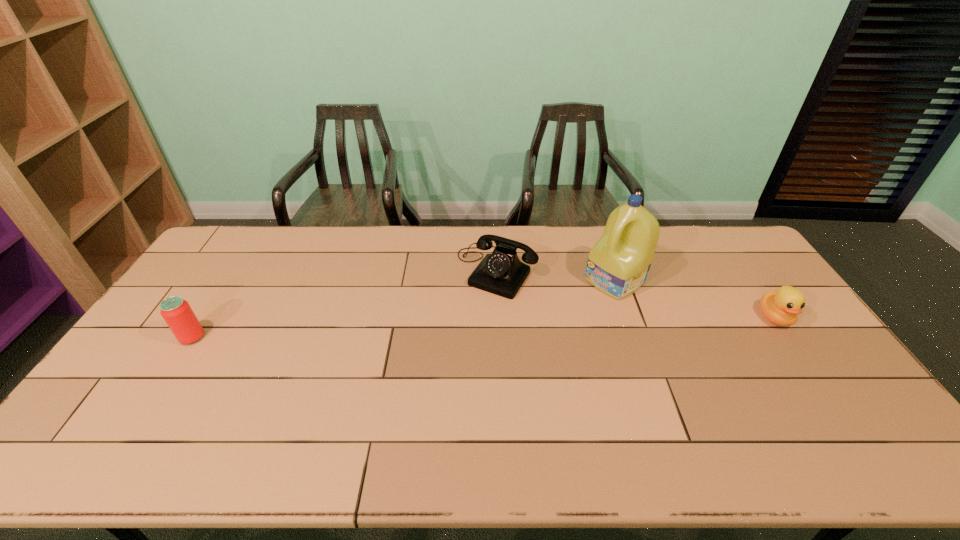
You are a GUI agent. You are given a task and a screenshot of the screen. Output one action in this format:
    pyautogui.click(x=<x>, y=<y>)
    Task: Click on the free spot located 0.140m on the front face of the second object from left to right
    The image size is (960, 540).
    Given the screenshot: What is the action you would take?
    pyautogui.click(x=458, y=325)

Where is `vacant space located 0.370m on the front face of the second object from left to right`? Image resolution: width=960 pixels, height=540 pixels. vacant space located 0.370m on the front face of the second object from left to right is located at coordinates click(418, 382).

The height and width of the screenshot is (540, 960). I want to click on vacant space located on the front face of the second object from left to right, so click(x=458, y=325).

Locate an element on the screen. detergent that is at the far edge is located at coordinates (618, 265).

Where is `telephone located in the far edge section of the desktop`? Image resolution: width=960 pixels, height=540 pixels. telephone located in the far edge section of the desktop is located at coordinates (502, 273).

Where is `object that is at the left edge`? Image resolution: width=960 pixels, height=540 pixels. object that is at the left edge is located at coordinates (177, 313).

Where is `object that is at the right edge`? The height and width of the screenshot is (540, 960). object that is at the right edge is located at coordinates (781, 307).

Find the location of a particular element. vacant space at the far edge of the desktop is located at coordinates (459, 237).

Identify the location of vacant space at the near edge. The width and height of the screenshot is (960, 540). (479, 410).

Image resolution: width=960 pixels, height=540 pixels. What are the coordinates of `vacant space at the left edge` in the screenshot? It's located at (174, 378).